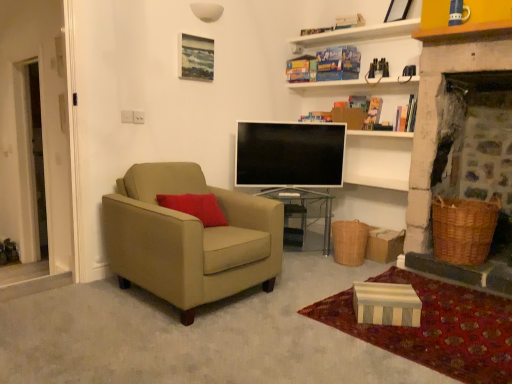
Question: In terms of height, does suede beige armchair at left look taller or shorter compared to woven brown picnic basket at lower right, which is counted as the 1th picnic basket, starting from the right?

Choices:
 (A) short
 (B) tall

Answer: (B)

Question: From the image's perspective, is suede beige armchair at left positioned above or below woven brown picnic basket at lower right, acting as the 2th picnic basket starting from the left?

Choices:
 (A) above
 (B) below

Answer: (A)

Question: Which is nearer to the matte wooden picture frame at upper center?

Choices:
 (A) flat screen tv at center
 (B) suede beige armchair at left
 (C) transparent glass table at center
 (D) striped cardboard box at lower right
 (E) striped cardboard box at lower right

Answer: (A)

Question: Based on their relative distances, which object is nearer to the flat screen tv at center?

Choices:
 (A) striped cardboard box at lower right
 (B) suede beige armchair at left
 (C) woven brown picnic basket at lower right, acting as the 2th picnic basket starting from the left
 (D) woven brown picnic basket at lower center, which is the 2th picnic basket in right-to-left order
 (E) transparent glass table at center

Answer: (E)